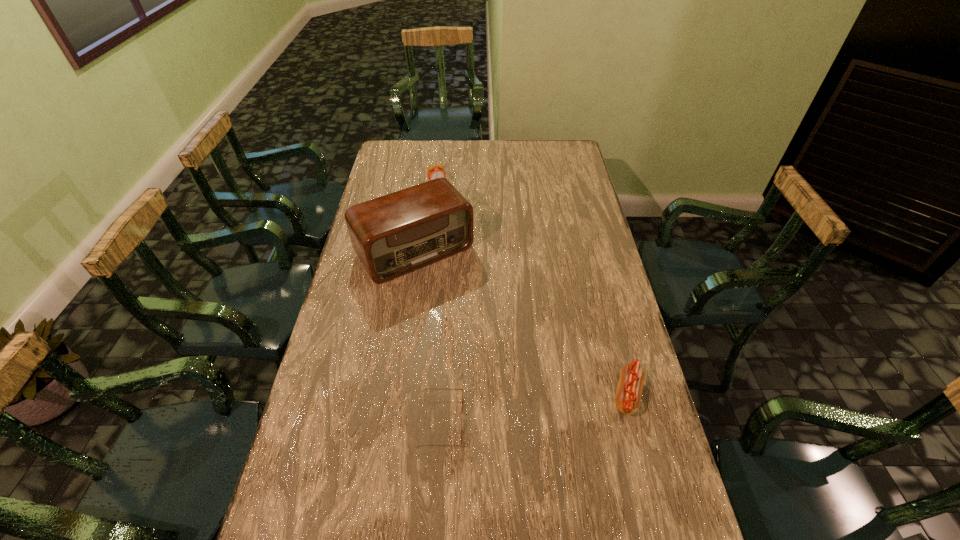
Locate an element on the screen. free space on the desktop that is between the shortest object and the sausage and is positioned on the front panel of the tallest object is located at coordinates (530, 409).

The image size is (960, 540). Find the location of `free space on the desktop that is between the shortest object and the second shortest object and is positioned on the face of the alarm clock`. free space on the desktop that is between the shortest object and the second shortest object and is positioned on the face of the alarm clock is located at coordinates (541, 407).